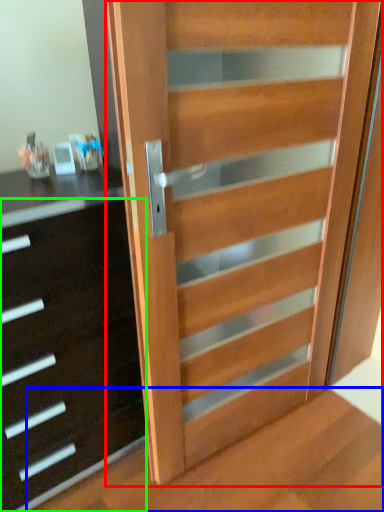
Question: Which object is positioned closest to door (highlighted by a red box)? Select from stairwell (highlighted by a blue box) and chest of drawers (highlighted by a green box).

Choices:
 (A) stairwell
 (B) chest of drawers

Answer: (B)